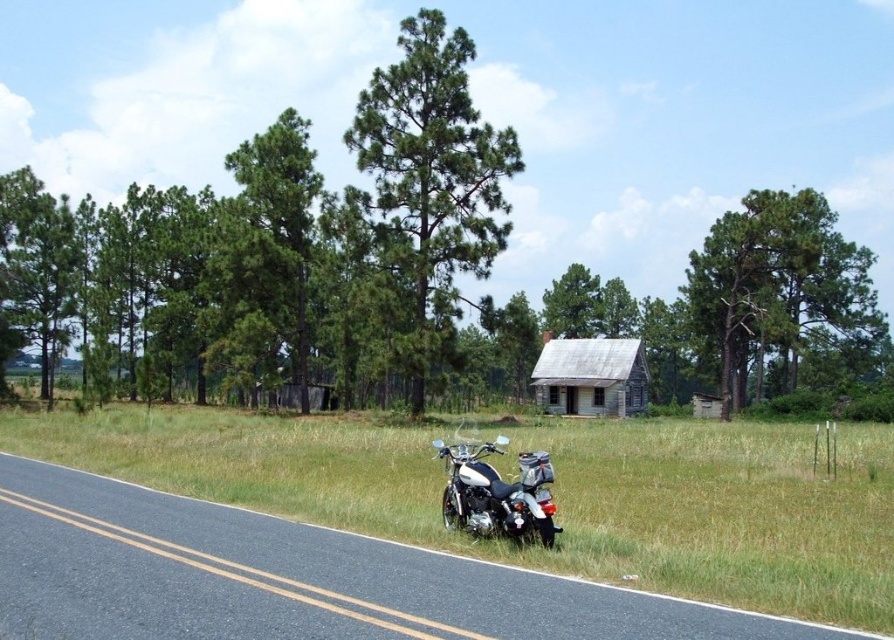
You are a hiker who wants to take a photo of the weathered wood cabin at center and the green pine tree at center. Which object should you focus on first if you want to capture both in the same frame without moving your camera?

The green pine tree at center is larger than the weathered wood cabin at center, so you should focus on the green pine tree at center first to ensure it fits within the frame.

You are a hiker trying to determine the distance between two trees in the image. You see a green pine tree at center and a green textured tree at upper right. Which tree is taller?

The green textured tree at upper right is taller than the green pine tree at center.

You are standing at the edge of the road where the motorcycle is parked. Looking towards the green pine tree at center, in which direction should you walk to reach it?

Since the green pine tree at center is located at coordinates approximately 0.291 on the x and 0.480 on the y axis, you would need to walk towards the center of the image to reach it from the motorcycle on the road edge.